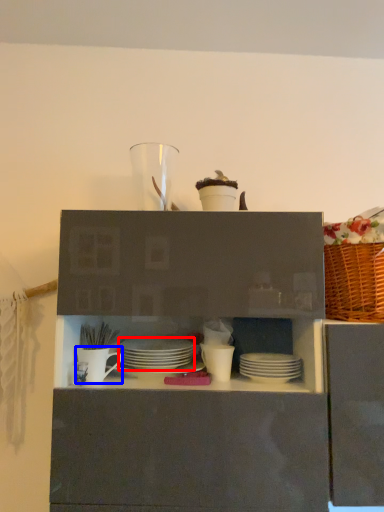
Question: Among these objects, which one is nearest to the camera, tableware (highlighted by a red box) or tableware (highlighted by a blue box)?

Choices:
 (A) tableware
 (B) tableware

Answer: (B)